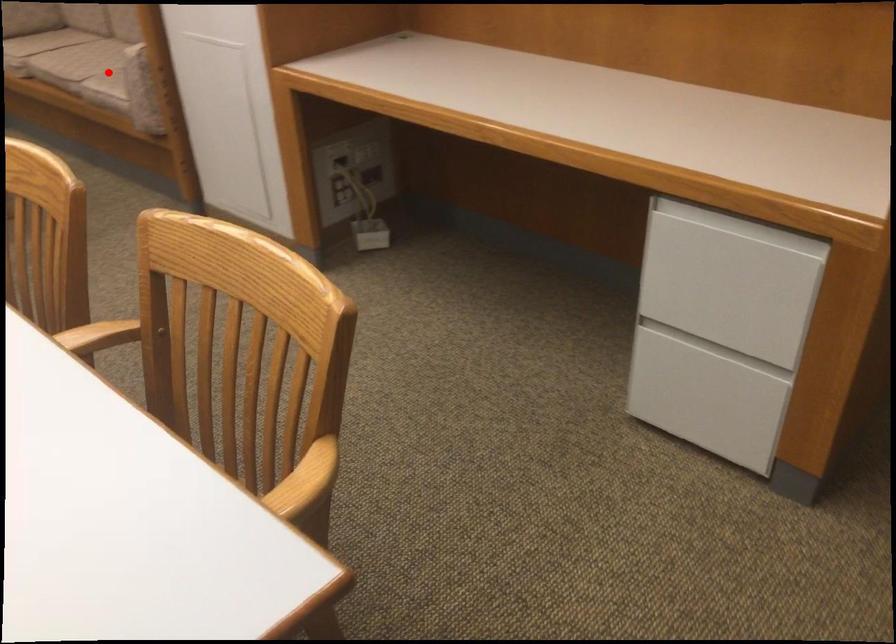
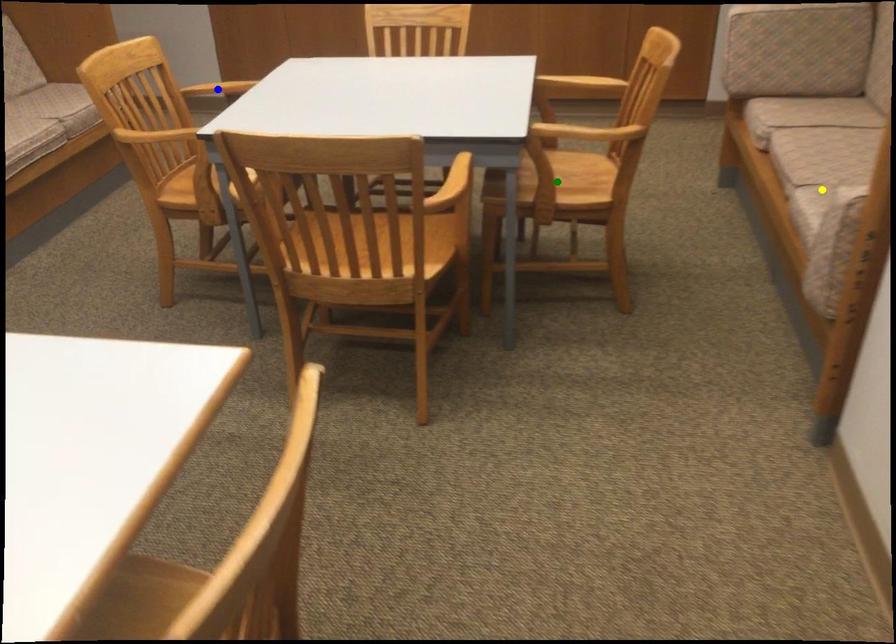
Question: I am providing you with two images of the same scene from different viewpoints. A red point is marked on the first image. You are given multiple points on the second image. Which mark in image 2 goes with the point in image 1?

Choices:
 (A) yellow point
 (B) green point
 (C) blue point

Answer: (A)